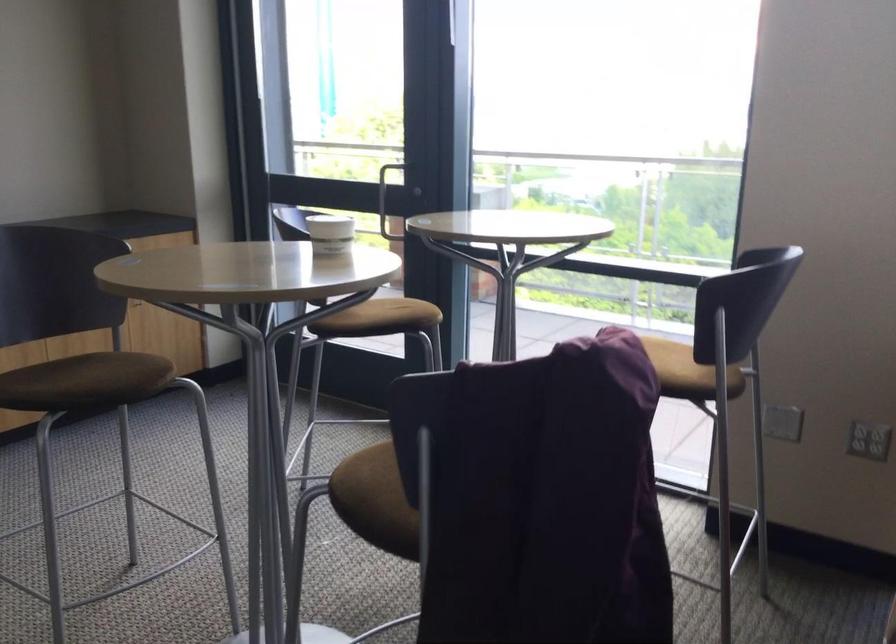
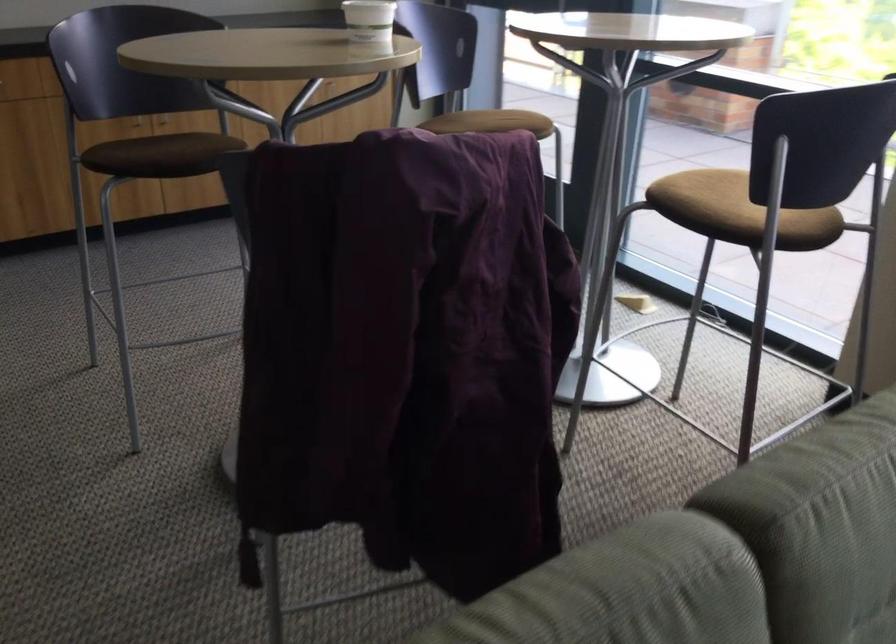
Question: The camera is either moving clockwise (left) or counter-clockwise (right) around the object. The first image is from the beginning of the video and the second image is from the end. Is the camera moving left or right when shooting the video?

Choices:
 (A) Left
 (B) Right

Answer: (B)